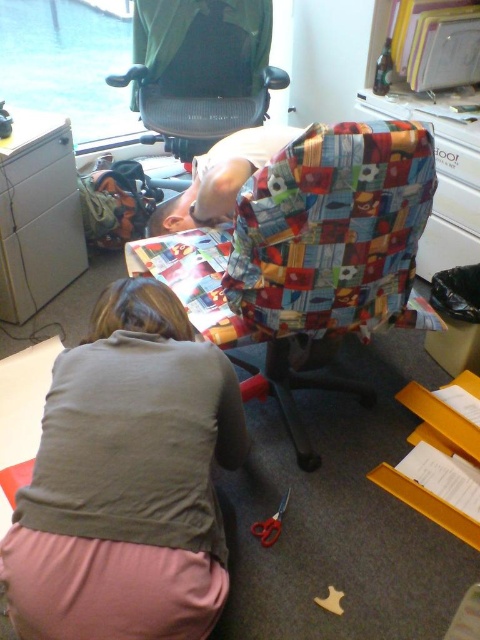
Is pink fabric at lower left bigger than metallic gray filing cabinet at left?

Incorrect, pink fabric at lower left is not larger than metallic gray filing cabinet at left.

Can you confirm if pink fabric at lower left is positioned below metallic gray filing cabinet at left?

Indeed, pink fabric at lower left is positioned under metallic gray filing cabinet at left.

Image resolution: width=480 pixels, height=640 pixels. Find the location of `pink fabric at lower left`. pink fabric at lower left is located at coordinates (108, 588).

Between green fabric swivel chair at upper center and metallic gray filing cabinet at left, which one appears on the left side from the viewer's perspective?

From the viewer's perspective, metallic gray filing cabinet at left appears more on the left side.

From the picture: Between green fabric swivel chair at upper center and metallic gray filing cabinet at left, which one has more height?

Standing taller between the two is metallic gray filing cabinet at left.

Is point (160, 122) in front of point (1, 192)?

No.

This screenshot has height=640, width=480. What are the coordinates of `green fabric swivel chair at upper center` in the screenshot? It's located at (206, 80).

Which of these two, light brown fabric shirt at lower left or green fabric swivel chair at upper center, stands shorter?

Standing shorter between the two is green fabric swivel chair at upper center.

Can you confirm if light brown fabric shirt at lower left is positioned to the right of green fabric swivel chair at upper center?

Correct, you'll find light brown fabric shirt at lower left to the right of green fabric swivel chair at upper center.

You are a GUI agent. You are given a task and a screenshot of the screen. Output one action in this format:
    pyautogui.click(x=<x>, y=<y>)
    Task: Click on the light brown fabric shirt at lower left
    Image resolution: width=480 pixels, height=640 pixels.
    Given the screenshot: What is the action you would take?
    pyautogui.click(x=128, y=481)